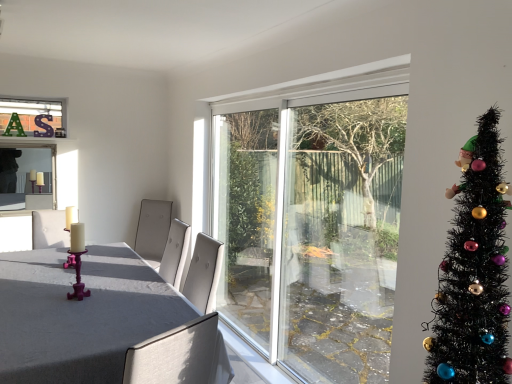
Find the location of `free space to the left of white glossy candle at left`. free space to the left of white glossy candle at left is located at coordinates (40, 269).